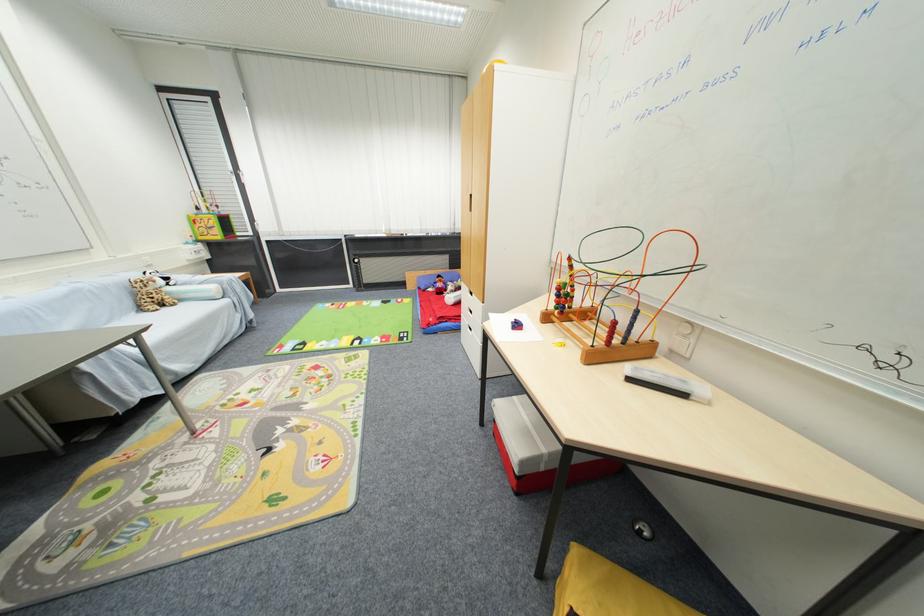
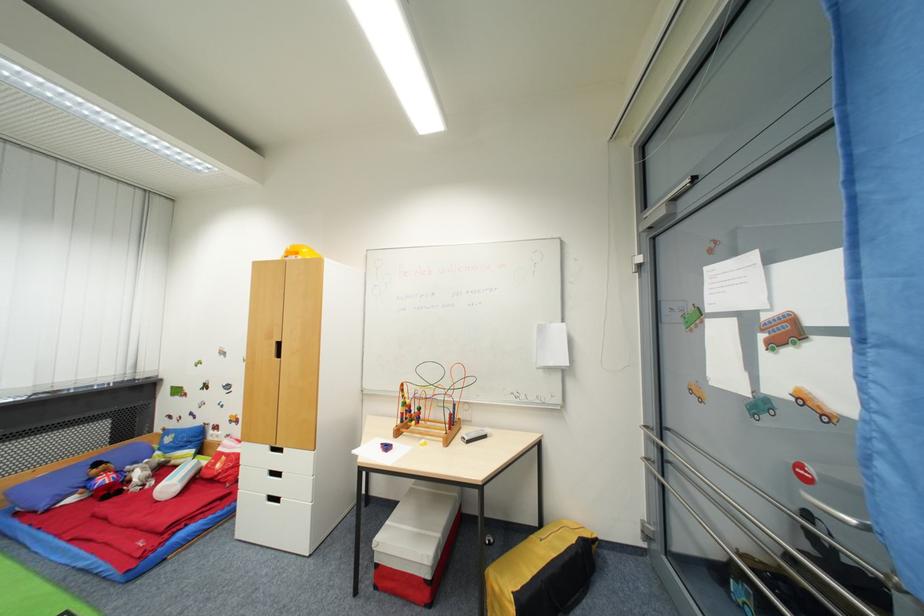
Question: How did the camera likely rotate?

Choices:
 (A) Left
 (B) Right
 (C) Up
 (D) Down

Answer: (B)